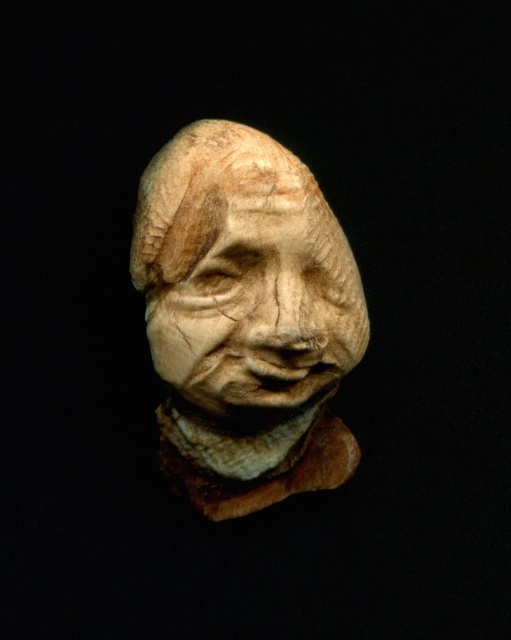
Question: From the image, what is the correct spatial relationship of matte beige stone head at center in relation to matte beige sculpture at center?

Choices:
 (A) above
 (B) below

Answer: (B)

Question: Is matte beige stone head at center above matte beige sculpture at center?

Choices:
 (A) no
 (B) yes

Answer: (A)

Question: Which point is farther from the camera taking this photo?

Choices:
 (A) (299, 209)
 (B) (266, 250)

Answer: (A)

Question: Can you confirm if matte beige stone head at center is wider than matte beige sculpture at center?

Choices:
 (A) no
 (B) yes

Answer: (B)

Question: Which of the following is the closest to the observer?

Choices:
 (A) (225, 301)
 (B) (234, 221)

Answer: (B)